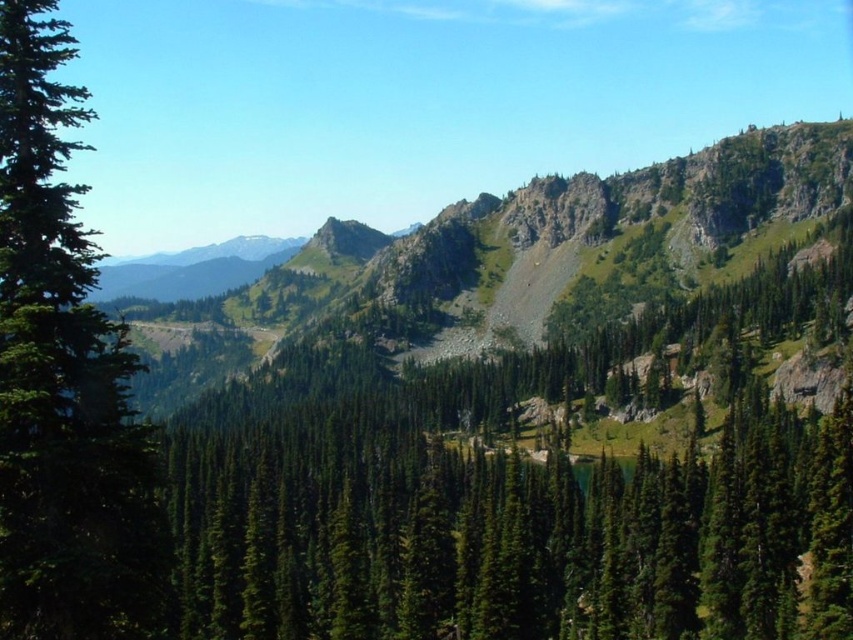
You are planning a hiking route and need to decide whether to start at the green rocky mountain at center or the green matte tree at left. Based on their sizes, which would be a better starting point for a shorter hike?

The green matte tree at left is smaller in size compared to the green rocky mountain at center, so starting at the green matte tree at left would be better for a shorter hike.

You are a hiker planning to take a photo of the green rocky mountain at center and the green matte tree at left. Which object should you focus on first if you want to capture both in a single frame without moving your camera?

You should focus on the green rocky mountain at center first because it is located above the green matte tree at left, so adjusting focus to the mountain ensures both are in the frame.